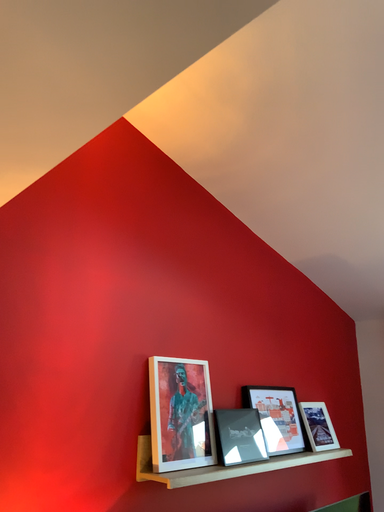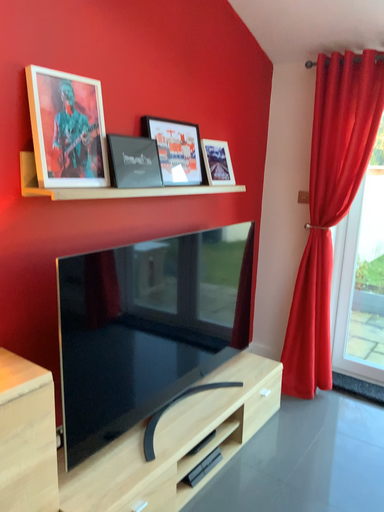
Question: How did the camera likely rotate when shooting the video?

Choices:
 (A) rotated right
 (B) rotated left

Answer: (A)